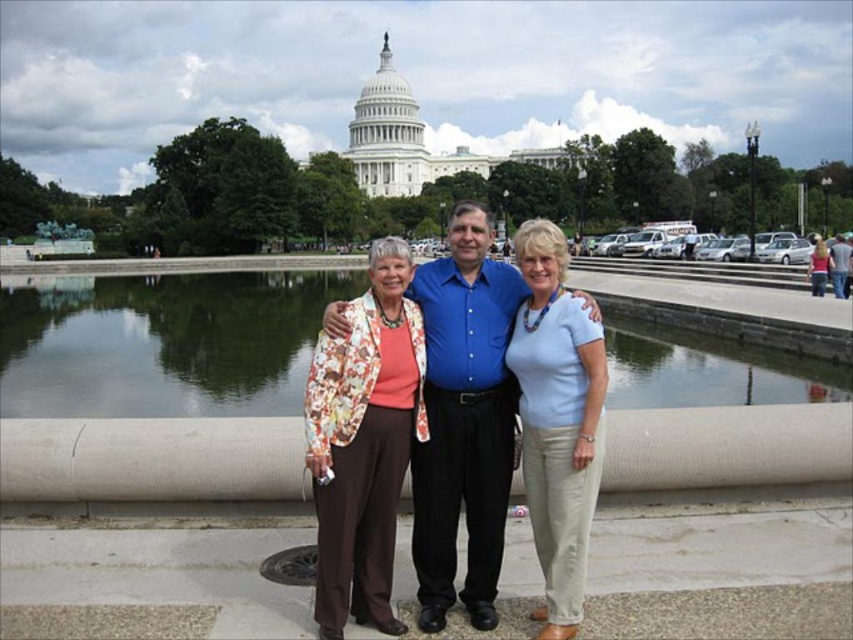
Question: Is transparent glass water at center bigger than floral-patterned fabric jacket at center?

Choices:
 (A) no
 (B) yes

Answer: (B)

Question: Which of the following is the closest to the observer?

Choices:
 (A) (566, 344)
 (B) (811, 253)

Answer: (A)

Question: Based on their relative distances, which object is farther from the blue cotton shirt at center?

Choices:
 (A) floral-patterned blouse at center
 (B) transparent glass water at center
 (C) floral-patterned jacket at center

Answer: (C)

Question: Based on their relative distances, which object is farther from the light blue cotton shirt at center?

Choices:
 (A) blue cotton shirt at center
 (B) floral-patterned jacket at center
 (C) floral-patterned fabric jacket at center
 (D) floral-patterned blouse at center

Answer: (A)

Question: Does floral-patterned fabric jacket at center appear on the left side of light blue cotton shirt at center?

Choices:
 (A) yes
 (B) no

Answer: (A)

Question: Does transparent glass water at center appear under light blue cotton shirt at center?

Choices:
 (A) yes
 (B) no

Answer: (B)